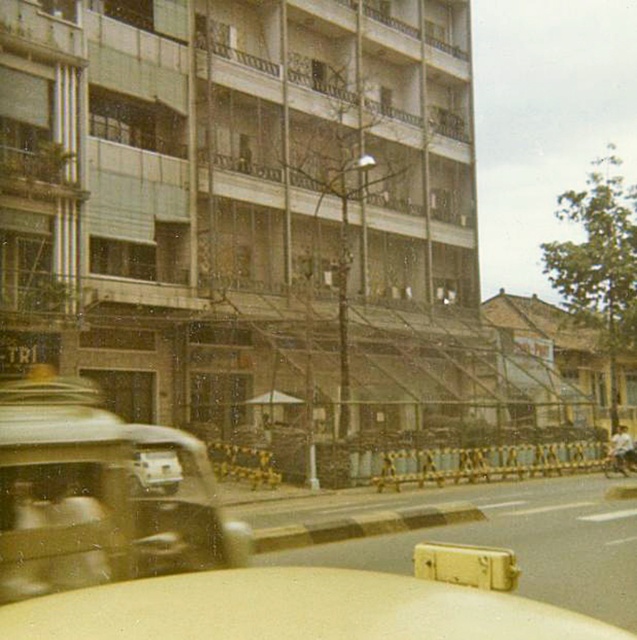
Question: Among these objects, which one is nearest to the camera?

Choices:
 (A) metallic gold car at left
 (B) shiny chrome motorcycle at right

Answer: (A)

Question: Is yellow matte car at center above metallic gold car at left?

Choices:
 (A) yes
 (B) no

Answer: (A)

Question: Which object is farther from the camera taking this photo?

Choices:
 (A) yellow matte car at center
 (B) metallic gold car at left
 (C) shiny chrome motorcycle at right

Answer: (C)

Question: Is metallic gold car at left to the right of shiny chrome motorcycle at right from the viewer's perspective?

Choices:
 (A) no
 (B) yes

Answer: (A)

Question: Based on their relative distances, which object is farther from the yellow matte car at center?

Choices:
 (A) shiny chrome motorcycle at right
 (B) metallic gold car at left

Answer: (A)

Question: Is yellow matte car at center positioned before metallic gold car at left?

Choices:
 (A) no
 (B) yes

Answer: (B)